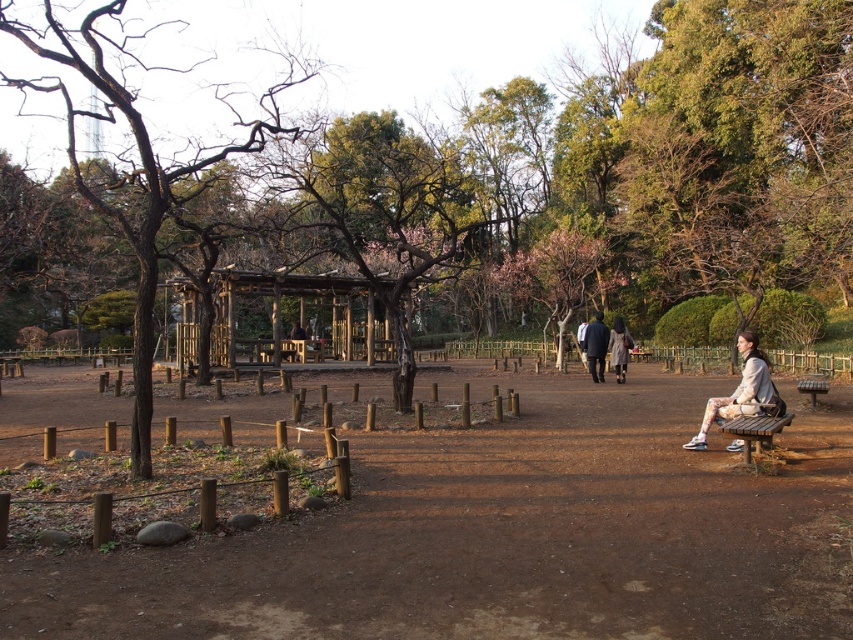
You are a hiker who needs to decide whether to walk along the brown dirt path at center or take the light beige fabric jacket at lower right to reach the gazebo. Which path is shorter?

The brown dirt path at center is shorter than the light beige fabric jacket at lower right, so you should choose the brown dirt path at center to reach the gazebo.

In the scene shown: You are standing at the edge of the park and see both the wooden gazebo at center and the dark blue coat at center. Which object is higher up in the image?

The wooden gazebo at center is above the dark blue coat at center, so the wooden gazebo at center is higher up in the image.